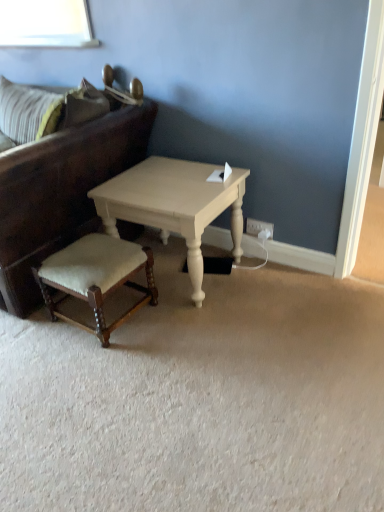
Question: Is velvet beige stool at lower left next to white painted wood coffee table at center and touching it?

Choices:
 (A) no
 (B) yes

Answer: (A)

Question: Is velvet beige stool at lower left wider than white painted wood coffee table at center?

Choices:
 (A) yes
 (B) no

Answer: (B)

Question: Considering the relative sizes of velvet beige stool at lower left and white painted wood coffee table at center in the image provided, is velvet beige stool at lower left shorter than white painted wood coffee table at center?

Choices:
 (A) no
 (B) yes

Answer: (B)

Question: From a real-world perspective, is velvet beige stool at lower left physically above white painted wood coffee table at center?

Choices:
 (A) no
 (B) yes

Answer: (A)

Question: From a real-world perspective, is velvet beige stool at lower left physically below white painted wood coffee table at center?

Choices:
 (A) no
 (B) yes

Answer: (B)

Question: Is velvet beige stool at lower left completely or partially outside of white painted wood coffee table at center?

Choices:
 (A) no
 (B) yes

Answer: (B)

Question: Is dark brown leather studio couch at left bigger than velvet beige stool at lower left?

Choices:
 (A) no
 (B) yes

Answer: (B)

Question: Is dark brown leather studio couch at left positioned beyond the bounds of velvet beige stool at lower left?

Choices:
 (A) no
 (B) yes

Answer: (B)

Question: Is dark brown leather studio couch at left closer to the viewer compared to velvet beige stool at lower left?

Choices:
 (A) no
 (B) yes

Answer: (B)

Question: Can you confirm if dark brown leather studio couch at left is smaller than velvet beige stool at lower left?

Choices:
 (A) no
 (B) yes

Answer: (A)

Question: Is dark brown leather studio couch at left beside velvet beige stool at lower left?

Choices:
 (A) no
 (B) yes

Answer: (A)

Question: Considering the relative sizes of dark brown leather studio couch at left and velvet beige stool at lower left in the image provided, is dark brown leather studio couch at left thinner than velvet beige stool at lower left?

Choices:
 (A) no
 (B) yes

Answer: (A)

Question: Can you confirm if white plastic electric outlet at lower right is shorter than velvet beige stool at lower left?

Choices:
 (A) no
 (B) yes

Answer: (B)